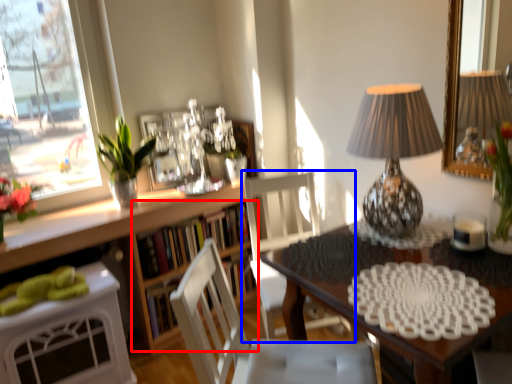
Question: Which object appears farthest to the camera in this image, shelf (highlighted by a red box) or chair (highlighted by a blue box)?

Choices:
 (A) shelf
 (B) chair

Answer: (A)